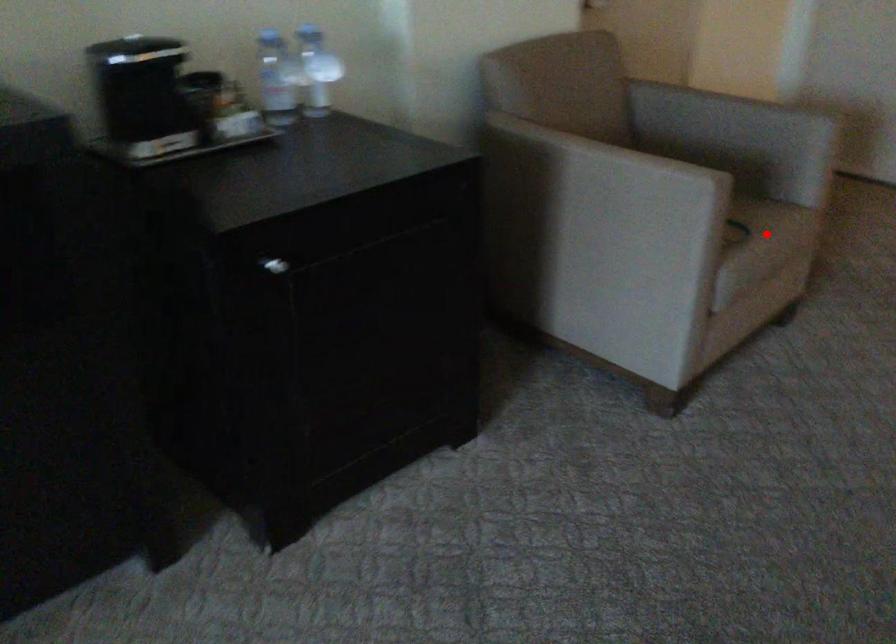
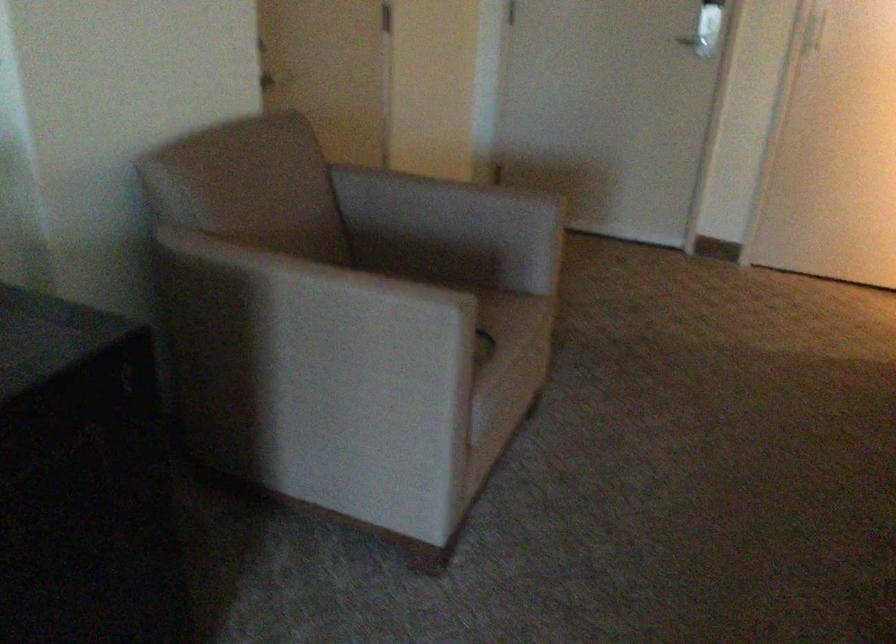
Question: A red point is marked in image1. In image2, is the corresponding 3D point closer to the camera or farther? Reply with the corresponding letter.

Choices:
 (A) The corresponding 3D point is closer.
 (B) The corresponding 3D point is farther.

Answer: (A)